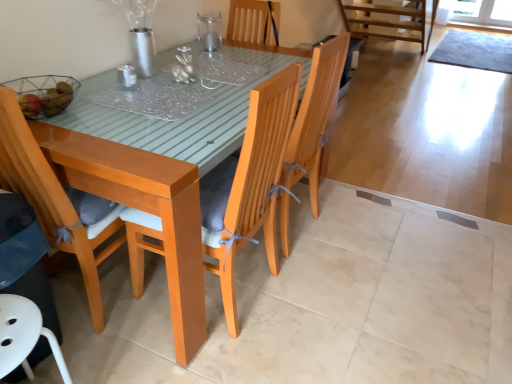
Question: Is matte wood chair at left, positioned as the 2th chair in right-to-left order, taller than white plastic chair at lower left, placed as the first chair when sorted from left to right?

Choices:
 (A) no
 (B) yes

Answer: (B)

Question: Is the surface of matte wood chair at left, positioned as the 2th chair in right-to-left order, in direct contact with white plastic chair at lower left, placed as the first chair when sorted from left to right?

Choices:
 (A) yes
 (B) no

Answer: (B)

Question: Considering the relative sizes of matte wood chair at left, placed as the 2th chair when sorted from left to right, and white plastic chair at lower left, which ranks as the third chair in right-to-left order, in the image provided, is matte wood chair at left, placed as the 2th chair when sorted from left to right, smaller than white plastic chair at lower left, which ranks as the third chair in right-to-left order,?

Choices:
 (A) no
 (B) yes

Answer: (A)

Question: From the image's perspective, would you say matte wood chair at left, positioned as the 2th chair in right-to-left order, is shown under white plastic chair at lower left, placed as the first chair when sorted from left to right?

Choices:
 (A) no
 (B) yes

Answer: (A)

Question: Is matte wood chair at left, positioned as the 2th chair in right-to-left order, not within white plastic chair at lower left, placed as the first chair when sorted from left to right?

Choices:
 (A) yes
 (B) no

Answer: (A)

Question: From the image's perspective, relative to metallic silver candlestick at center, the second tableware when ordered from top to bottom, is white plastic chair at lower left, which ranks as the third chair in right-to-left order, above or below?

Choices:
 (A) above
 (B) below

Answer: (B)

Question: Does point (14, 304) appear closer or farther from the camera than point (131, 66)?

Choices:
 (A) closer
 (B) farther

Answer: (A)

Question: Would you say white plastic chair at lower left, which ranks as the third chair in right-to-left order, is inside or outside metallic silver candlestick at center, placed as the second tableware when sorted from back to front?

Choices:
 (A) outside
 (B) inside

Answer: (A)

Question: Is white plastic chair at lower left, which ranks as the third chair in right-to-left order, wider or thinner than metallic silver candlestick at center, placed as the second tableware when sorted from back to front?

Choices:
 (A) wide
 (B) thin

Answer: (A)

Question: From the image's perspective, relative to metallic silver candlestick at center, which is the 1th tableware in front-to-back order, is wooden chair at center, marked as the first chair in a right-to-left arrangement, above or below?

Choices:
 (A) below
 (B) above

Answer: (A)

Question: From a real-world perspective, is wooden chair at center, the third chair positioned from the left, physically located above or below metallic silver candlestick at center, acting as the first tableware starting from the left?

Choices:
 (A) below
 (B) above

Answer: (A)

Question: Relative to metallic silver candlestick at center, the second tableware when ordered from top to bottom, is wooden chair at center, marked as the first chair in a right-to-left arrangement, in front or behind?

Choices:
 (A) front
 (B) behind

Answer: (A)

Question: Is wooden chair at center, marked as the first chair in a right-to-left arrangement, bigger or smaller than metallic silver candlestick at center, positioned as the second tableware in right-to-left order?

Choices:
 (A) big
 (B) small

Answer: (A)

Question: Which is correct: white plastic chair at lower left, placed as the first chair when sorted from left to right, is inside clear glass vase at upper center, which appears as the first tableware when viewed from the right, or outside of it?

Choices:
 (A) inside
 (B) outside

Answer: (B)

Question: From the image's perspective, is white plastic chair at lower left, which ranks as the third chair in right-to-left order, positioned above or below clear glass vase at upper center, the 2th tableware when ordered from left to right?

Choices:
 (A) below
 (B) above

Answer: (A)